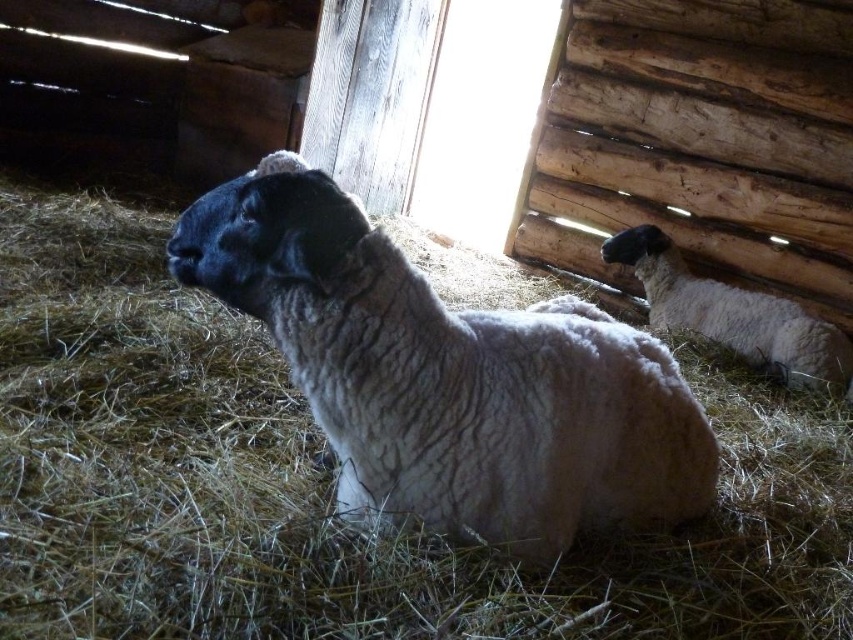
You are standing in the barn and want to move from the white woolen sheep at center to the white woolen sheep at right. Which direction should you move to reach the sheep at right?

The white woolen sheep at center is located below the white woolen sheep at right, so you should move upward to reach the sheep at right.

You are a farmer checking the size of your sheep. You have a pen that can only accommodate sheep up to the width of the white woolen sheep at right. Can the white woolen sheep at center fit into the pen?

The white woolen sheep at center is wider than the white woolen sheep at right, so it cannot fit into the pen designed for the smaller sheep.

You are a farmer standing at the point marked as point (427, 477). You need to reach the barn door located at the opposite side of the barn. The sheep in the foreground is blocking your path. Can you walk around it without getting too close? The minimum safe distance you need to keep from the sheep is 1 meter.

The sheep in the foreground is blocking your path. Since they are 1.55 meters apart, you can walk around the sheep while maintaining a safe distance of at least 1 meter from it.